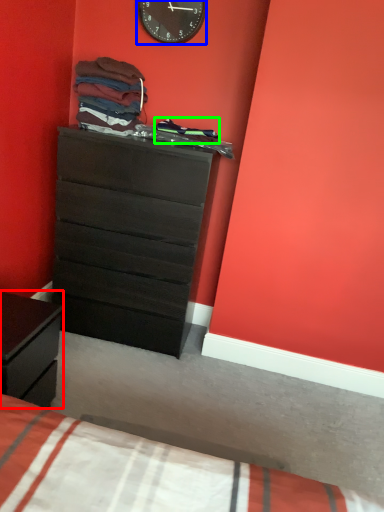
Question: Which object is the closest to the nightstand (highlighted by a red box)? Choose among these: wall clock (highlighted by a blue box) or clothing (highlighted by a green box).

Choices:
 (A) wall clock
 (B) clothing

Answer: (B)